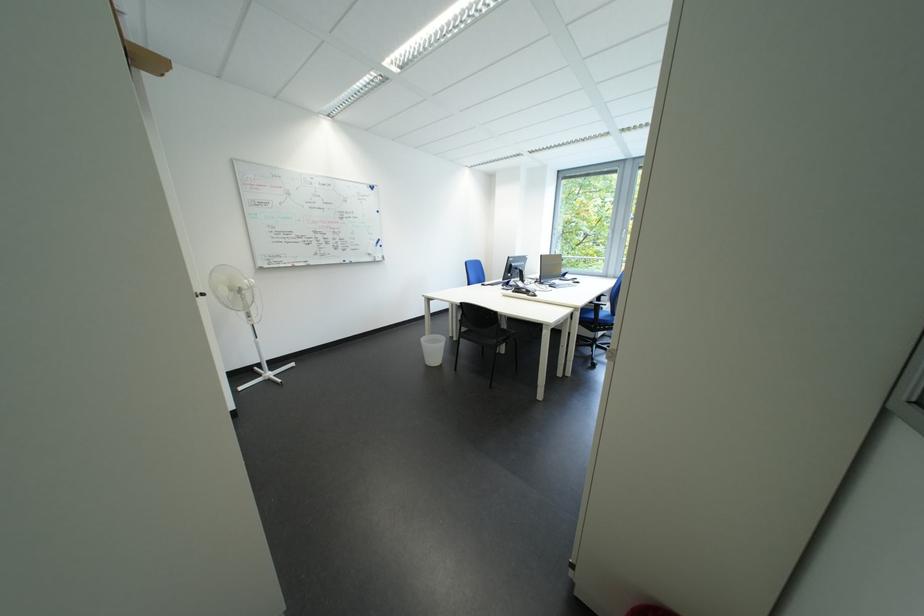
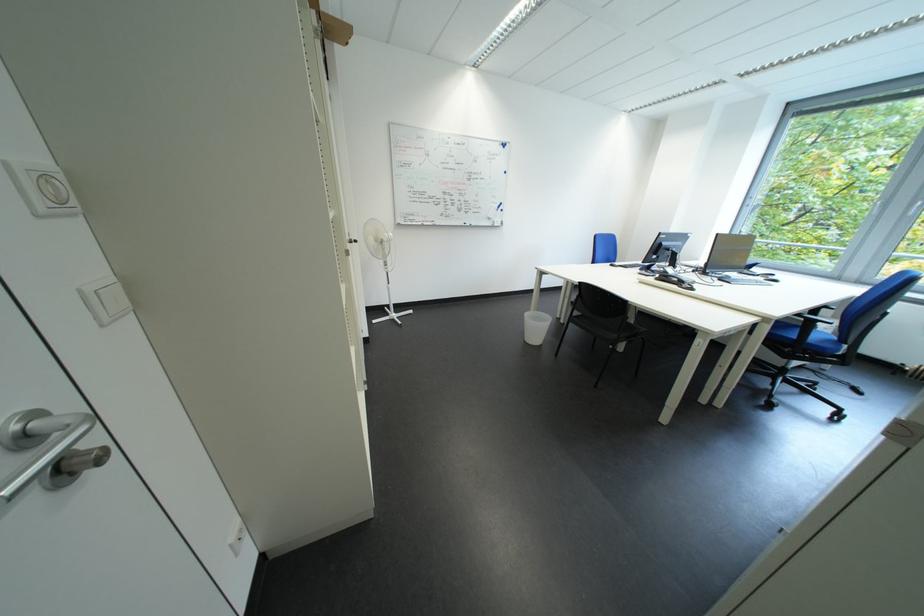
Where in the second image is the point corresponding to the point at 589,312 from the first image?

(777, 322)